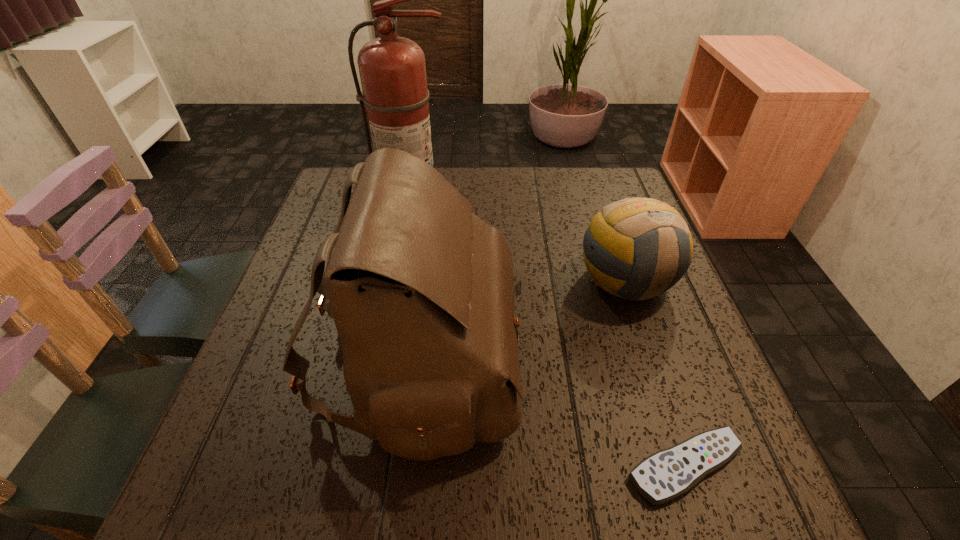
I want to click on the tallest object, so click(x=392, y=69).

Find the location of `the farthest object`. the farthest object is located at coordinates (392, 69).

Find the location of a particular element. the second tallest object is located at coordinates (421, 290).

Where is `volleyball`? volleyball is located at coordinates (637, 248).

Find the location of a particular element. The width and height of the screenshot is (960, 540). the shortest object is located at coordinates coord(668,474).

Find the location of `vacant region located on the front-facing side of the farthest object`. vacant region located on the front-facing side of the farthest object is located at coordinates click(x=391, y=326).

Find the location of `free spot located 0.080m on the front flap of the third shortest object`. free spot located 0.080m on the front flap of the third shortest object is located at coordinates click(x=558, y=362).

This screenshot has height=540, width=960. I want to click on vacant space positioned on the back of the second shortest object, so click(602, 210).

Identify the location of vacant space located 0.110m on the left of the shortest object. The width and height of the screenshot is (960, 540). (556, 466).

Locate an element on the screen. This screenshot has width=960, height=540. object that is at the far edge is located at coordinates [x=392, y=69].